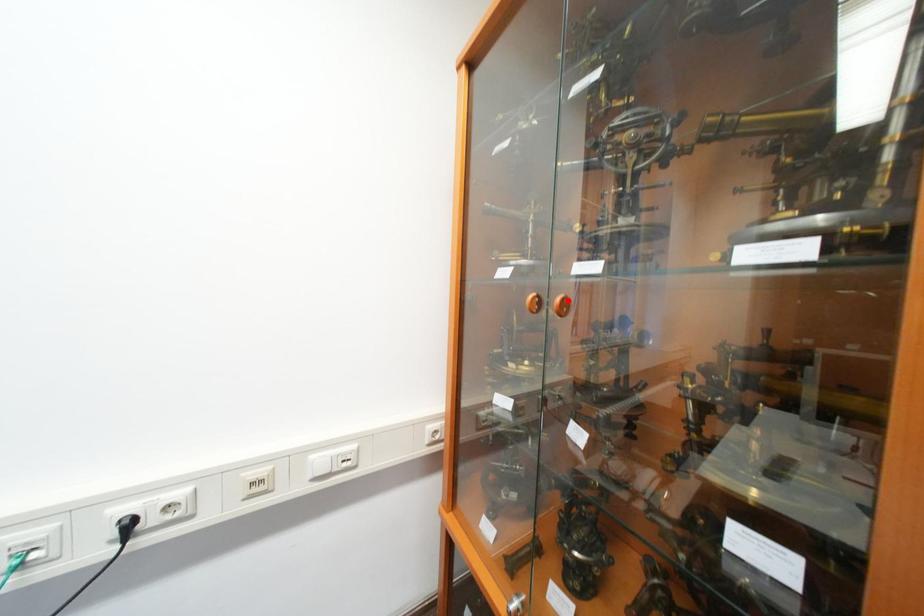
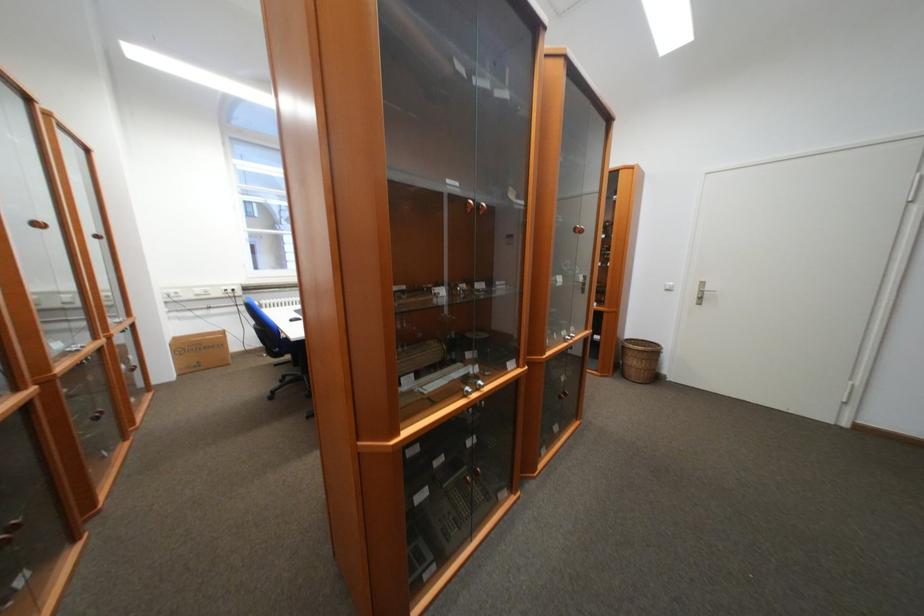
Question: I am providing you with two images of the same scene from different viewpoints. A red point is marked on the first image. Is the red point's position out of view in image 2?

Choices:
 (A) Yes
 (B) No

Answer: (A)